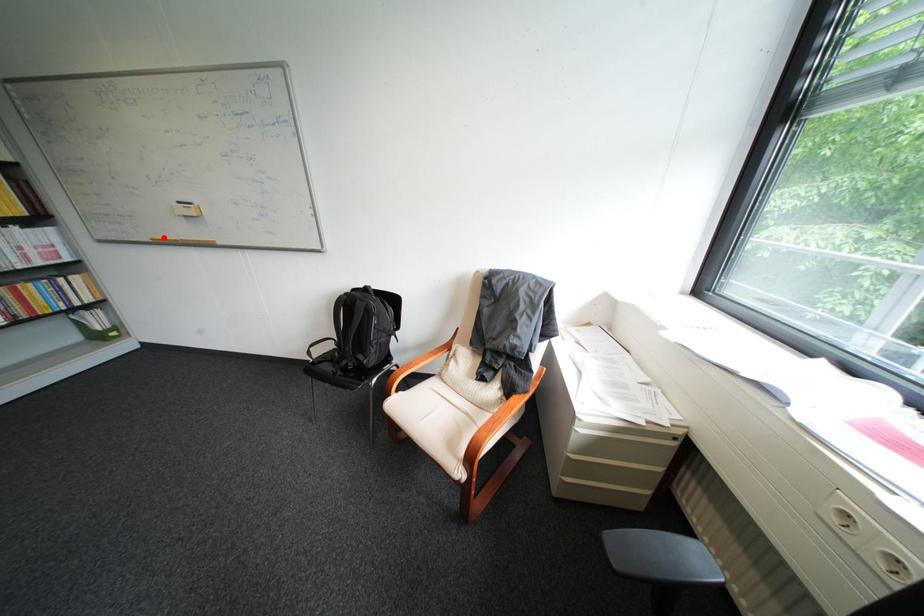
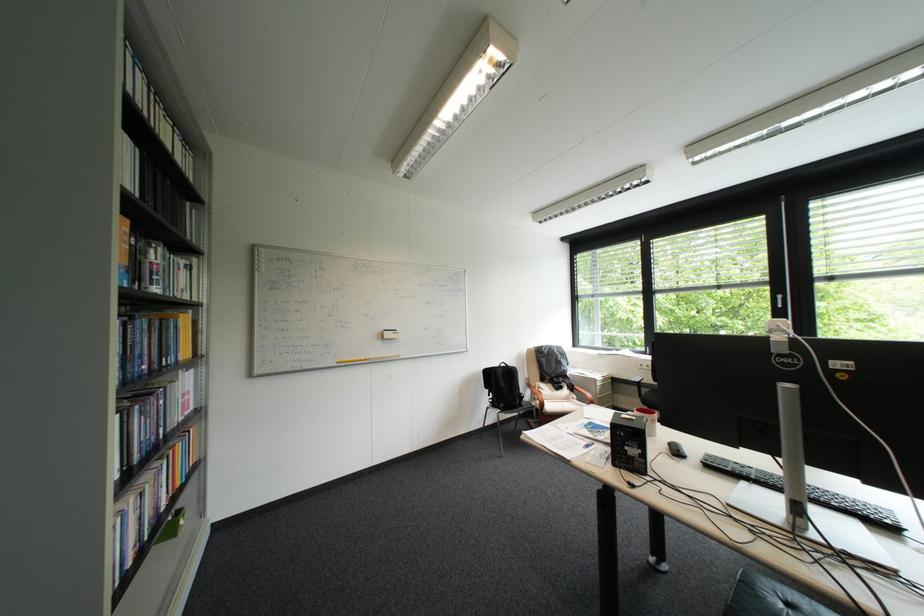
Where in the second image is the point corresponding to the highlighted location from the first image?

(350, 361)